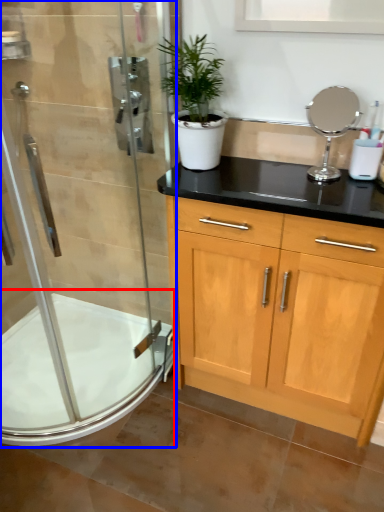
Question: Which object is further to the camera taking this photo, bath (highlighted by a red box) or shower door (highlighted by a blue box)?

Choices:
 (A) bath
 (B) shower door

Answer: (A)